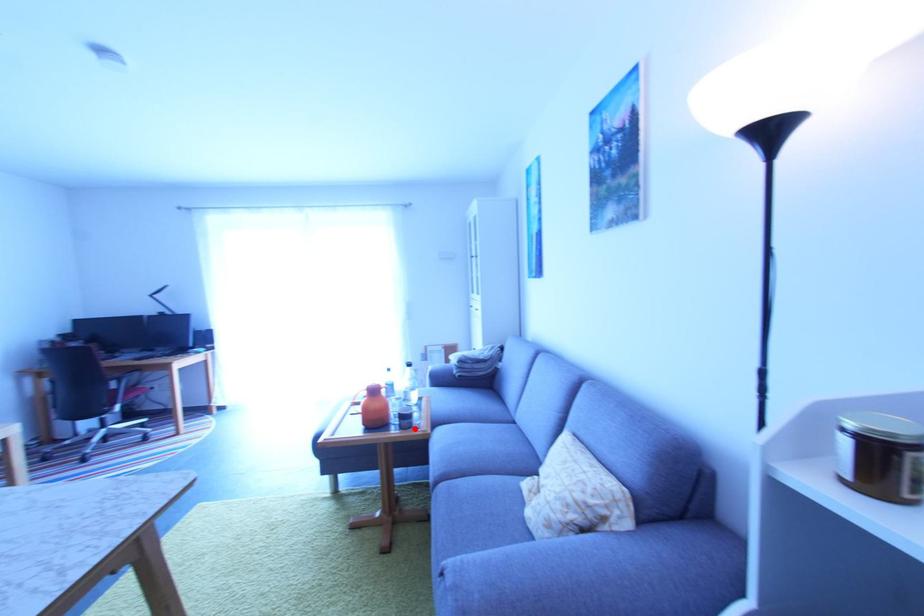
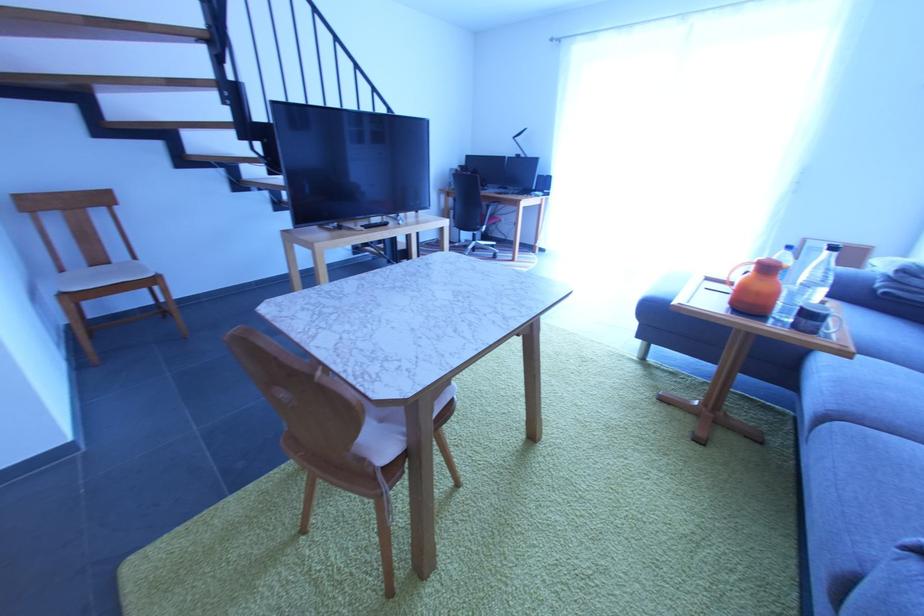
Question: A red point is marked in image1. In image2, is the corresponding 3D point closer to the camera or farther? Reply with the corresponding letter.

Choices:
 (A) The corresponding 3D point is closer.
 (B) The corresponding 3D point is farther.

Answer: (A)